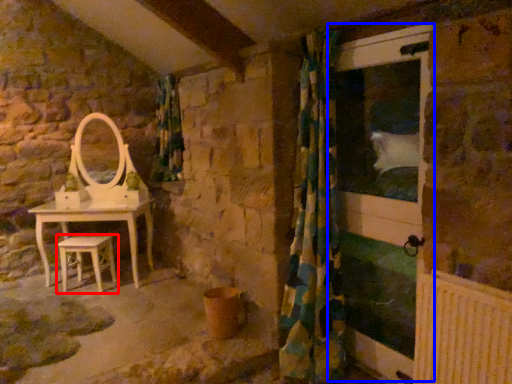
Question: Which point is closer to the camera, stool (highlighted by a red box) or screen door (highlighted by a blue box)?

Choices:
 (A) stool
 (B) screen door

Answer: (B)